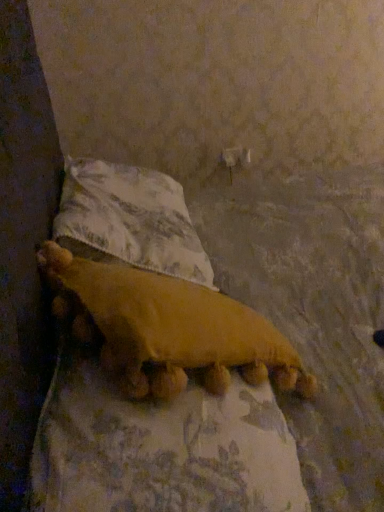
This screenshot has height=512, width=384. Describe the element at coordinates (130, 220) in the screenshot. I see `fluffy beige pillow at left` at that location.

Where is `fluffy beige pillow at left`? fluffy beige pillow at left is located at coordinates (130, 220).

Measure the distance between point (93, 162) and camera.

4.34 feet.

Where is `fluffy beige pillow at left`? The image size is (384, 512). fluffy beige pillow at left is located at coordinates (130, 220).